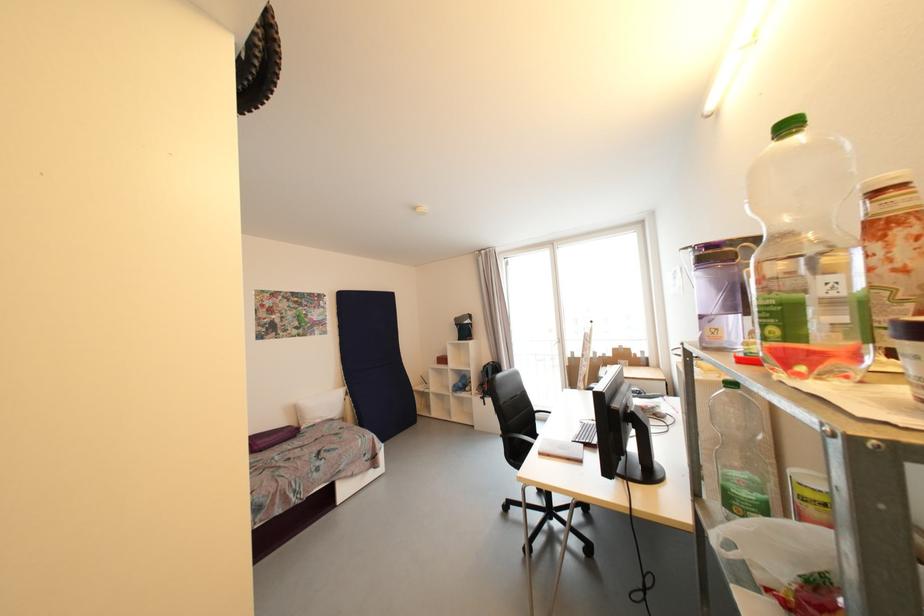
This screenshot has width=924, height=616. What do you see at coordinates (517, 448) in the screenshot? I see `the black chair sitting surface` at bounding box center [517, 448].